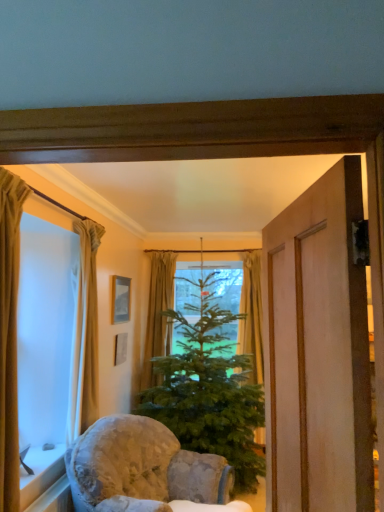
Question: Considering the relative sizes of beige fabric curtain at left, the 1th curtain when ordered from front to back, and green matte christmas tree at center in the image provided, is beige fabric curtain at left, the 1th curtain when ordered from front to back, taller than green matte christmas tree at center?

Choices:
 (A) no
 (B) yes

Answer: (A)

Question: Can you see beige fabric curtain at left, placed as the fourth curtain when sorted from back to front, touching green matte christmas tree at center?

Choices:
 (A) yes
 (B) no

Answer: (B)

Question: From a real-world perspective, is beige fabric curtain at left, the 1th curtain when ordered from front to back, beneath green matte christmas tree at center?

Choices:
 (A) no
 (B) yes

Answer: (A)

Question: Is beige fabric curtain at left, placed as the fourth curtain when sorted from back to front, shorter than green matte christmas tree at center?

Choices:
 (A) yes
 (B) no

Answer: (A)

Question: From the image's perspective, is beige fabric curtain at left, the 1th curtain when ordered from front to back, beneath green matte christmas tree at center?

Choices:
 (A) no
 (B) yes

Answer: (A)

Question: In the image, is green matte christmas tree at center positioned in front of or behind white stone window sill at lower left?

Choices:
 (A) front
 (B) behind

Answer: (B)

Question: In the image, is green matte christmas tree at center on the left side or the right side of white stone window sill at lower left?

Choices:
 (A) left
 (B) right

Answer: (B)

Question: In terms of size, does green matte christmas tree at center appear bigger or smaller than white stone window sill at lower left?

Choices:
 (A) big
 (B) small

Answer: (A)

Question: Considering the positions of green matte christmas tree at center and white stone window sill at lower left in the image, is green matte christmas tree at center taller or shorter than white stone window sill at lower left?

Choices:
 (A) short
 (B) tall

Answer: (B)

Question: Visually, is green matte christmas tree at center positioned to the left or to the right of fluffy fabric chair at lower center?

Choices:
 (A) right
 (B) left

Answer: (A)

Question: Is green matte christmas tree at center wider or thinner than fluffy fabric chair at lower center?

Choices:
 (A) wide
 (B) thin

Answer: (A)

Question: From a real-world perspective, is green matte christmas tree at center above or below fluffy fabric chair at lower center?

Choices:
 (A) below
 (B) above

Answer: (B)

Question: From the image's perspective, is green matte christmas tree at center located above or below fluffy fabric chair at lower center?

Choices:
 (A) above
 (B) below

Answer: (A)

Question: From a real-world perspective, relative to green fabric curtain at center, acting as the third curtain starting from the left, is beige fabric curtain at left, which ranks as the third curtain in back-to-front order, vertically above or below?

Choices:
 (A) below
 (B) above

Answer: (B)

Question: Considering the positions of beige fabric curtain at left, placed as the third curtain when sorted from right to left, and green fabric curtain at center, which appears as the 2th curtain when viewed from the right, in the image, is beige fabric curtain at left, placed as the third curtain when sorted from right to left, bigger or smaller than green fabric curtain at center, which appears as the 2th curtain when viewed from the right,?

Choices:
 (A) small
 (B) big

Answer: (A)